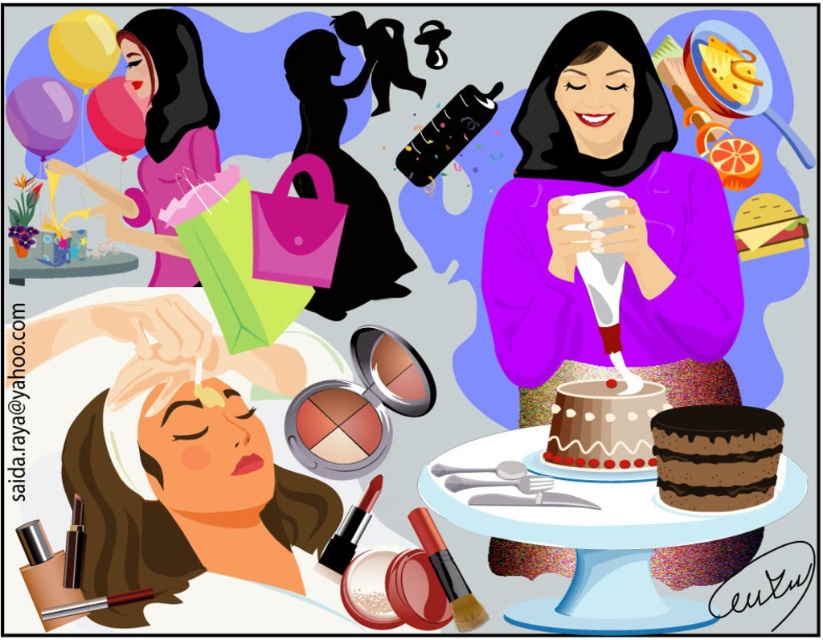
Does purple matte sweater at center have a lesser width compared to yellow matte balloon at upper left?

No.

Can you confirm if purple matte sweater at center is positioned below yellow matte balloon at upper left?

Yes, purple matte sweater at center is below yellow matte balloon at upper left.

Describe the element at coordinates (608, 227) in the screenshot. The image size is (823, 640). I see `purple matte sweater at center` at that location.

I want to click on purple matte sweater at center, so click(x=608, y=227).

Who is positioned more to the right, chocolatesmoothcake at right or yellow matte balloon at upper left?

Positioned to the right is chocolatesmoothcake at right.

The height and width of the screenshot is (640, 823). I want to click on chocolatesmoothcake at right, so click(715, 456).

Is chocolate frosted cake at center wider than yellow matte balloon at upper left?

Incorrect, chocolate frosted cake at center's width does not surpass yellow matte balloon at upper left's.

Between point (591, 396) and point (63, 54), which one is positioned in front?

Point (591, 396) is more forward.

The height and width of the screenshot is (640, 823). Describe the element at coordinates (603, 424) in the screenshot. I see `chocolate frosted cake at center` at that location.

This screenshot has height=640, width=823. I want to click on chocolate frosted cake at center, so pos(603,424).